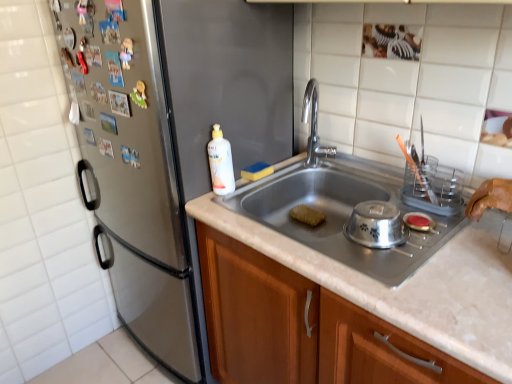
Where is `vacant area that lies to the right of silver metallic bowl at sink`? This screenshot has width=512, height=384. vacant area that lies to the right of silver metallic bowl at sink is located at coordinates (439, 242).